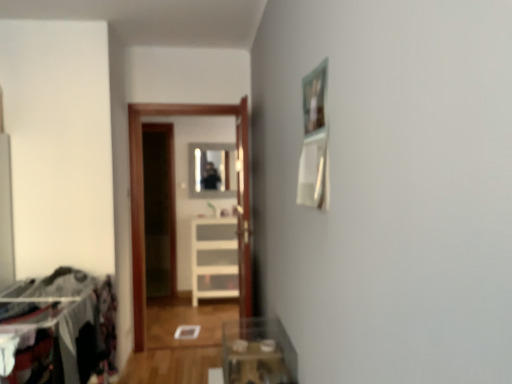
Question: Does clear glass mirror at center contain dark fabric laundry at left?

Choices:
 (A) no
 (B) yes

Answer: (A)

Question: Is clear glass mirror at center closer to camera compared to dark fabric laundry at left?

Choices:
 (A) no
 (B) yes

Answer: (A)

Question: Can you confirm if clear glass mirror at center is wider than dark fabric laundry at left?

Choices:
 (A) yes
 (B) no

Answer: (B)

Question: Are clear glass mirror at center and dark fabric laundry at left making contact?

Choices:
 (A) yes
 (B) no

Answer: (B)

Question: Can you confirm if clear glass mirror at center is bigger than dark fabric laundry at left?

Choices:
 (A) no
 (B) yes

Answer: (A)

Question: Can you confirm if clear glass mirror at center is positioned to the left of dark fabric laundry at left?

Choices:
 (A) yes
 (B) no

Answer: (B)

Question: From the image's perspective, does clear glass mirror at center appear lower than transparent glass door at center?

Choices:
 (A) no
 (B) yes

Answer: (A)

Question: From the image's perspective, would you say clear glass mirror at center is positioned over transparent glass door at center?

Choices:
 (A) yes
 (B) no

Answer: (A)

Question: Is clear glass mirror at center thinner than transparent glass door at center?

Choices:
 (A) yes
 (B) no

Answer: (A)

Question: Can you confirm if clear glass mirror at center is wider than transparent glass door at center?

Choices:
 (A) no
 (B) yes

Answer: (A)

Question: Does clear glass mirror at center have a greater height compared to transparent glass door at center?

Choices:
 (A) yes
 (B) no

Answer: (B)

Question: Can you confirm if clear glass mirror at center is shorter than transparent glass door at center?

Choices:
 (A) no
 (B) yes

Answer: (B)

Question: Is clear glass table at lower center outside of white plastic drawer at center?

Choices:
 (A) yes
 (B) no

Answer: (A)